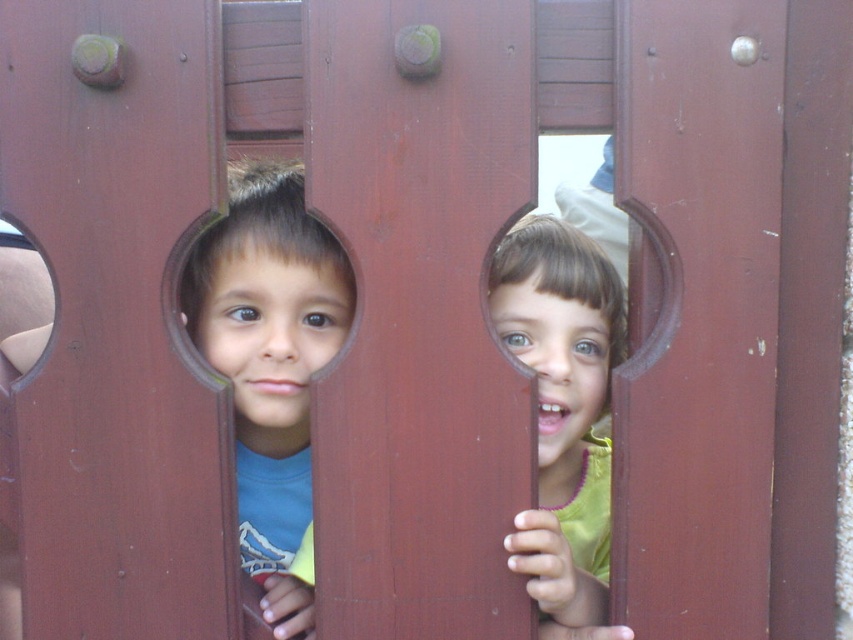
Question: Among these points, which one is nearest to the camera?

Choices:
 (A) (573, 627)
 (B) (337, 273)
 (C) (50, 292)

Answer: (A)

Question: Does matte green shirt at center have a smaller size compared to matte plastic hole at left?

Choices:
 (A) no
 (B) yes

Answer: (A)

Question: Which of the following is the farthest from the observer?

Choices:
 (A) matte blue shirt at left
 (B) matte green shirt at center

Answer: (A)

Question: Which point appears closest to the camera in this image?

Choices:
 (A) (582, 538)
 (B) (251, 380)

Answer: (B)

Question: Does matte green shirt at center have a smaller size compared to matte plastic hole at left?

Choices:
 (A) no
 (B) yes

Answer: (A)

Question: Considering the relative positions of matte blue shirt at left and matte green shirt at center in the image provided, where is matte blue shirt at left located with respect to matte green shirt at center?

Choices:
 (A) right
 (B) left

Answer: (B)